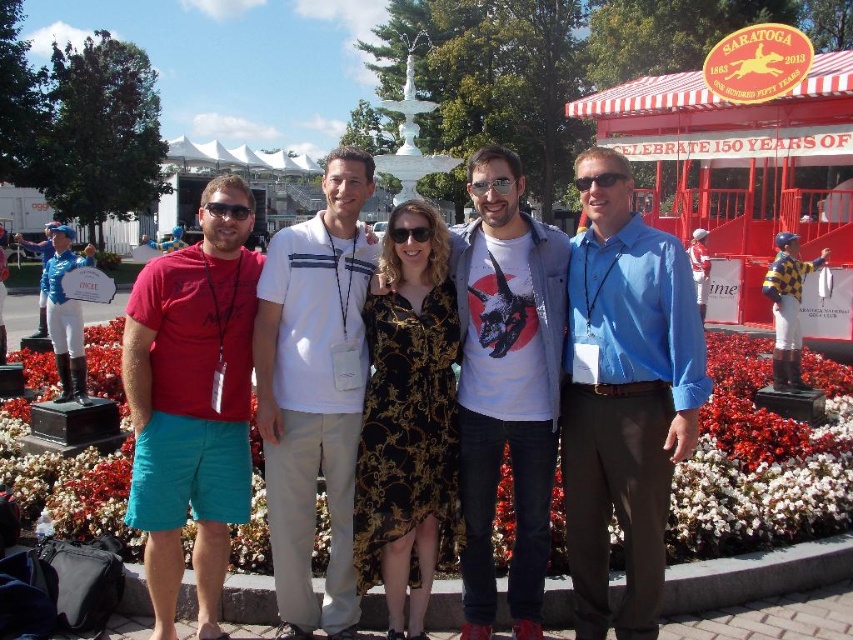
Consider the image. Who is shorter, matte red t-shirt at left or black plastic sunglasses at center?

black plastic sunglasses at center

Does matte red t-shirt at left have a lesser height compared to black plastic sunglasses at center?

Incorrect, matte red t-shirt at left's height does not fall short of black plastic sunglasses at center's.

Where is `matte red t-shirt at left`? matte red t-shirt at left is located at coordinates (192, 404).

Describe the element at coordinates (192, 404) in the screenshot. I see `matte red t-shirt at left` at that location.

Is point (196, 483) closer to camera compared to point (486, 253)?

Yes, point (196, 483) is closer to viewer.

Where is `matte red t-shirt at left`? This screenshot has height=640, width=853. matte red t-shirt at left is located at coordinates 192,404.

Who is positioned more to the left, blue shirt at center or matte black goggles at center?

Positioned to the left is matte black goggles at center.

Is point (596, 284) positioned behind point (242, 209)?

No, it is in front of (242, 209).

Locate an element on the screen. The height and width of the screenshot is (640, 853). blue shirt at center is located at coordinates (624, 400).